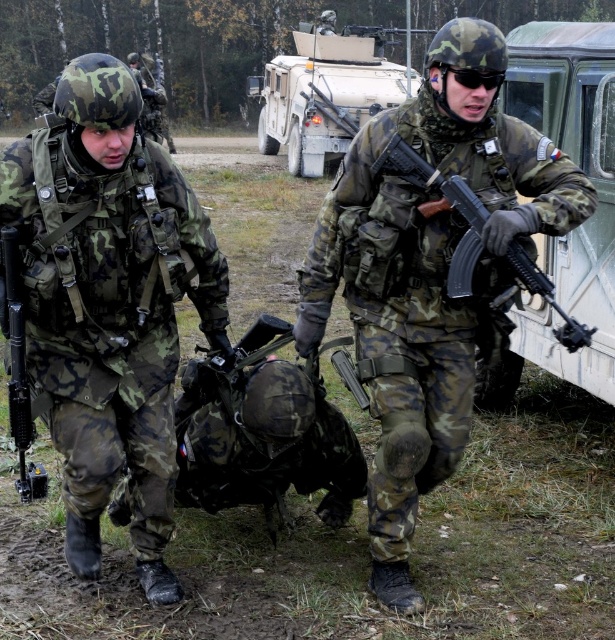
Consider the image. Is camouflage fabric uniform at center to the left of matte black rifle at center from the viewer's perspective?

Yes, camouflage fabric uniform at center is to the left of matte black rifle at center.

Which is more to the left, camouflage fabric uniform at center or matte black rifle at center?

camouflage fabric uniform at center

Identify the location of camouflage fabric uniform at center. The width and height of the screenshot is (615, 640). (109, 304).

Does camouflage fabric uniform at center have a lesser height compared to camouflage uniform at center?

Indeed, camouflage fabric uniform at center has a lesser height compared to camouflage uniform at center.

Who is more distant from viewer, [100,211] or [515,157]?

The point [515,157] is more distant.

Where is `camouflage fabric uniform at center`? camouflage fabric uniform at center is located at coordinates (109, 304).

Is camouflage-patterned military vehicle at center further to the viewer compared to matte black rifle at left?

That is True.

Can you confirm if camouflage-patterned military vehicle at center is positioned to the left of matte black rifle at left?

Incorrect, camouflage-patterned military vehicle at center is not on the left side of matte black rifle at left.

Between point (399, 92) and point (17, 368), which one is positioned in front?

Positioned in front is point (17, 368).

The width and height of the screenshot is (615, 640). I want to click on camouflage-patterned military vehicle at center, so click(325, 93).